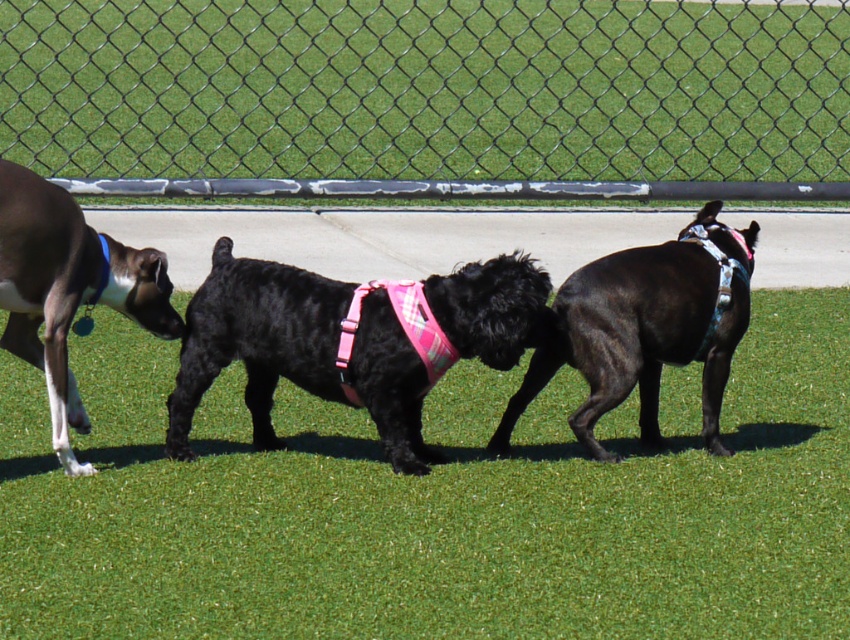
Does chain-link fence at center appear on the left side of shiny black dog at center?

Indeed, chain-link fence at center is positioned on the left side of shiny black dog at center.

Between chain-link fence at center and shiny black dog at center, which one has less height?

Standing shorter between the two is shiny black dog at center.

Does point (694, 170) come in front of point (649, 412)?

That is False.

The height and width of the screenshot is (640, 850). I want to click on chain-link fence at center, so [429, 99].

Can you confirm if shiny black dog at center is smaller than smooth brown dog at left?

No.

Is shiny black dog at center bigger than smooth brown dog at left?

Yes.

Which is in front, point (644, 355) or point (48, 259)?

Point (48, 259)

Where is `shiny black dog at center`? shiny black dog at center is located at coordinates (644, 330).

Can you confirm if green grass at center is shorter than chain-link fence at center?

Indeed, green grass at center has a lesser height compared to chain-link fence at center.

Can you confirm if green grass at center is smaller than chain-link fence at center?

Indeed, green grass at center has a smaller size compared to chain-link fence at center.

You are a GUI agent. You are given a task and a screenshot of the screen. Output one action in this format:
    pyautogui.click(x=<x>, y=<y>)
    Task: Click on the green grass at center
    The width and height of the screenshot is (850, 640).
    Given the screenshot: What is the action you would take?
    click(435, 504)